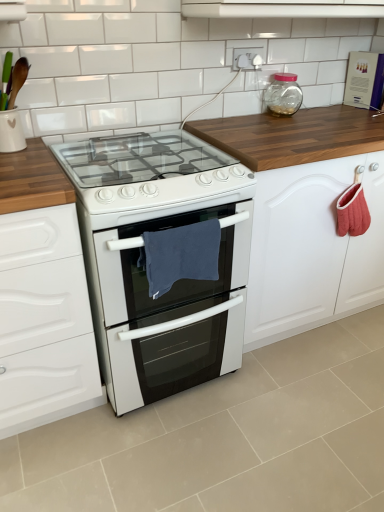
Question: Is white glossy oven at center shorter than transparent glass jar at upper right?

Choices:
 (A) no
 (B) yes

Answer: (A)

Question: Is white glossy oven at center positioned before transparent glass jar at upper right?

Choices:
 (A) yes
 (B) no

Answer: (A)

Question: Is white glossy oven at center wider than transparent glass jar at upper right?

Choices:
 (A) no
 (B) yes

Answer: (B)

Question: From the image's perspective, is white glossy oven at center located beneath transparent glass jar at upper right?

Choices:
 (A) yes
 (B) no

Answer: (A)

Question: Is white glossy oven at center outside of transparent glass jar at upper right?

Choices:
 (A) no
 (B) yes

Answer: (B)

Question: Would you consider white glossy oven at center to be distant from transparent glass jar at upper right?

Choices:
 (A) no
 (B) yes

Answer: (B)

Question: Is white glossy vent at upper center wider than white glossy tile at upper center?

Choices:
 (A) no
 (B) yes

Answer: (B)

Question: Does white glossy vent at upper center appear on the right side of white glossy tile at upper center?

Choices:
 (A) no
 (B) yes

Answer: (B)

Question: Is white glossy tile at upper center inside white glossy vent at upper center?

Choices:
 (A) yes
 (B) no

Answer: (B)

Question: Is white glossy vent at upper center not inside white glossy tile at upper center?

Choices:
 (A) yes
 (B) no

Answer: (A)

Question: Can you confirm if white glossy vent at upper center is positioned to the left of white glossy tile at upper center?

Choices:
 (A) no
 (B) yes

Answer: (A)

Question: From the image's perspective, would you say white glossy vent at upper center is positioned over white glossy tile at upper center?

Choices:
 (A) no
 (B) yes

Answer: (B)

Question: Can you confirm if blue fabric towel at center is positioned to the left of white glossy vent at upper center?

Choices:
 (A) yes
 (B) no

Answer: (A)